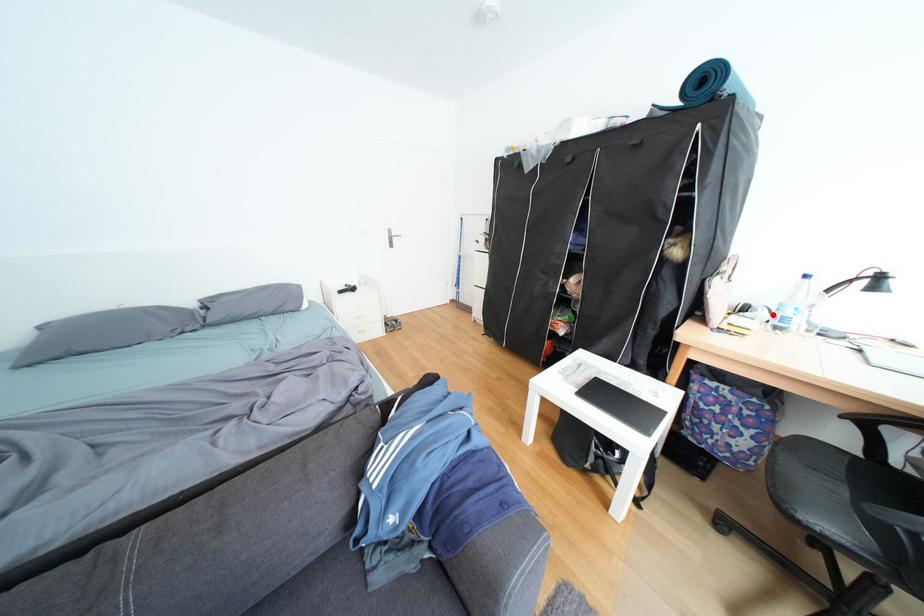
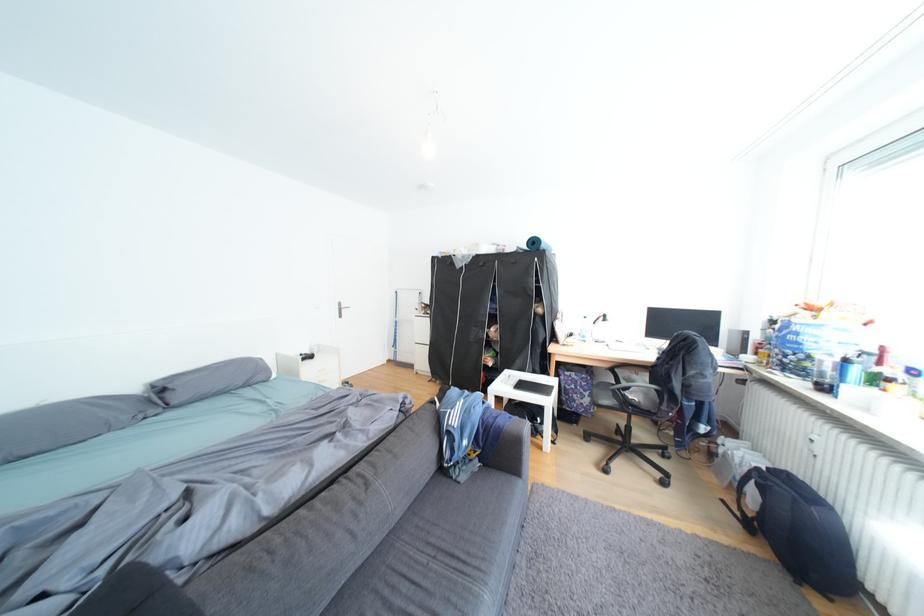
Question: I am providing you with two images of the same scene from different viewpoints. Image1 has a red point marked. In image2, the corresponding 3D location appears at what relative position? Reply with the corresponding letter.

Choices:
 (A) Closer
 (B) Farther

Answer: (B)